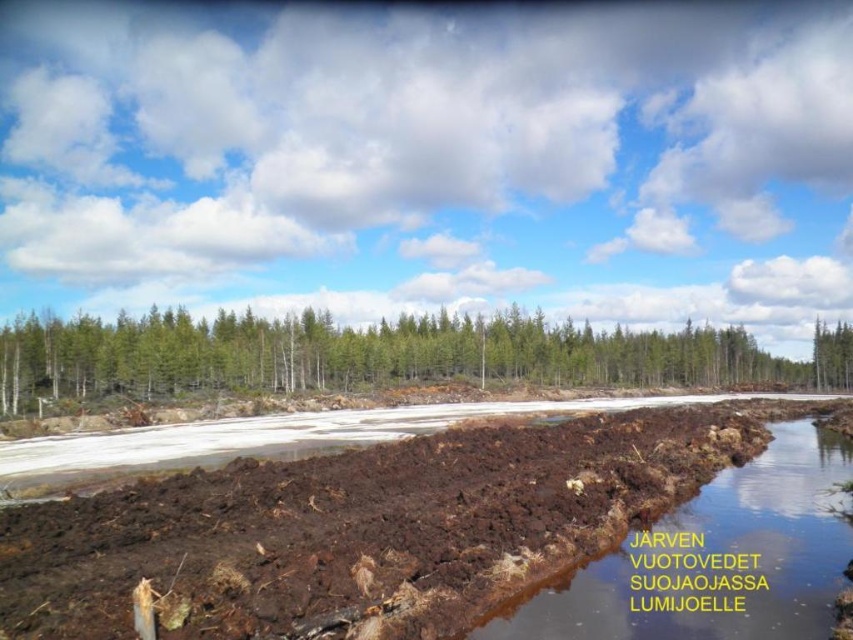
Which is behind, point (3, 358) or point (840, 573)?

The point (3, 358) is behind.

Between point (325, 381) and point (788, 564), which one is positioned in front?

Point (788, 564) is more forward.

Which is in front, point (202, 323) or point (817, 618)?

Point (817, 618) is in front.

Identify the location of green matte trees at center. Image resolution: width=853 pixels, height=640 pixels. (380, 355).

Between brown soil at center and green matte trees at center, which one is positioned lower?

brown soil at center

Is brown soil at center to the right of green matte trees at center from the viewer's perspective?

Incorrect, brown soil at center is not on the right side of green matte trees at center.

Is point (318, 513) behind point (167, 392)?

That is False.

At what (x,y) coordinates should I click in order to perform the action: click on brown soil at center. Please return your answer as a coordinate pair (x, y). Looking at the image, I should click on (363, 529).

Between brown soil at center and brown muddy water at center, which one is positioned lower?

brown muddy water at center is below.

Who is taller, brown soil at center or brown muddy water at center?

brown soil at center is taller.

Between point (766, 400) and point (693, 529), which one is positioned behind?

The point (766, 400) is behind.

At what (x,y) coordinates should I click in order to perform the action: click on brown soil at center. Please return your answer as a coordinate pair (x, y). Looking at the image, I should click on (363, 529).